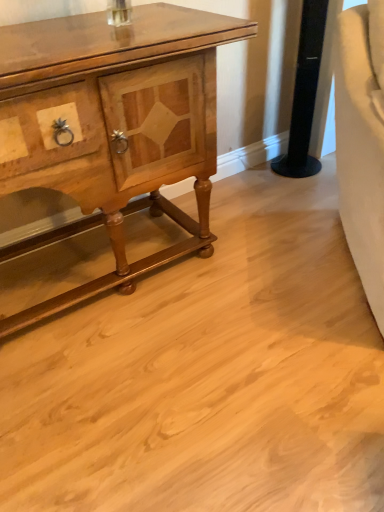
Where is `free spot in front of wooden polished cabinet at left`? The height and width of the screenshot is (512, 384). free spot in front of wooden polished cabinet at left is located at coordinates (148, 392).